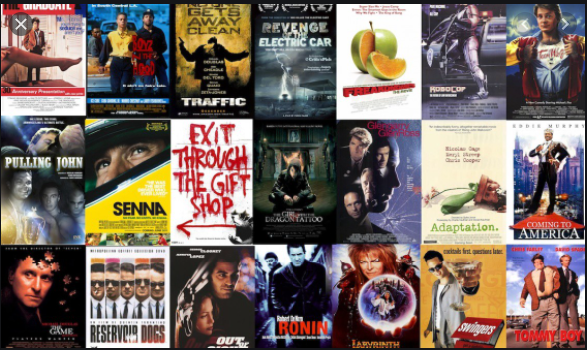
Where is `posters in middle row`? The image size is (587, 350). posters in middle row is located at coordinates (39, 179), (137, 177), (229, 171), (288, 168), (362, 167), (479, 160), (556, 160).